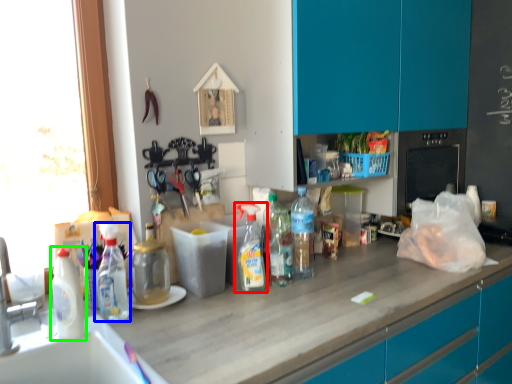
Question: Which is nearer to the bottle (highlighted by a red box)? bottle (highlighted by a blue box) or bottle (highlighted by a green box).

Choices:
 (A) bottle
 (B) bottle

Answer: (A)